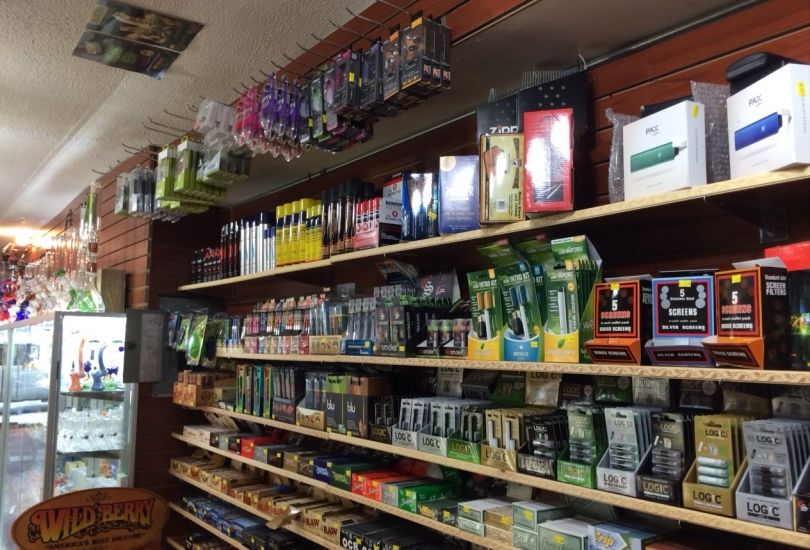
Identify the location of ceiling. This screenshot has height=550, width=810. (253, 27).